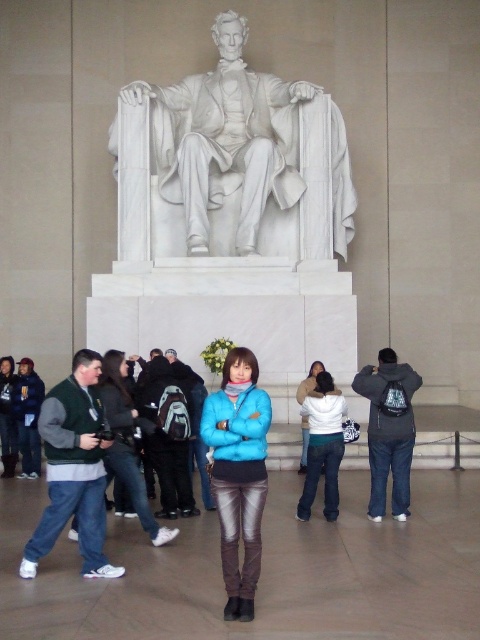
You are standing inside the Lincoln Memorial and want to take a photo of the statue. There are two points marked in the image. One is at coordinates point [178,157] and the other is at point [387,449]. Which point would be closer to you if you are facing the statue?

Point [178,157] is further to the viewer than point [387,449], so if you are facing the statue, the point at [178,157] would be closer to you.

From the picture: You are a photographer trying to capture a group photo of the blue matte jacket at center and the white fleece jacket at center. Which jacket should you focus on first to ensure it fits within the frame?

The blue matte jacket at center is bigger than the white fleece jacket at center, so you should focus on the blue matte jacket at center first to ensure it fits within the frame.